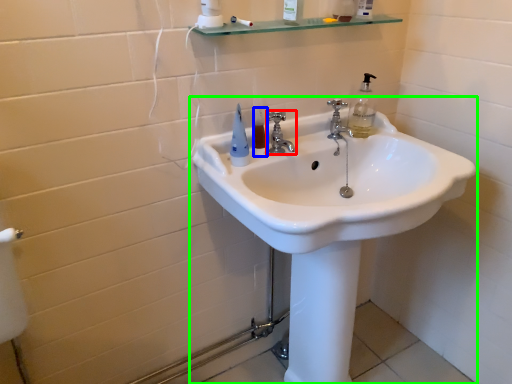
Question: Which object is the farthest from tap (highlighted by a red box)? Choose among these: mouthwash (highlighted by a blue box) or sink (highlighted by a green box).

Choices:
 (A) mouthwash
 (B) sink

Answer: (B)